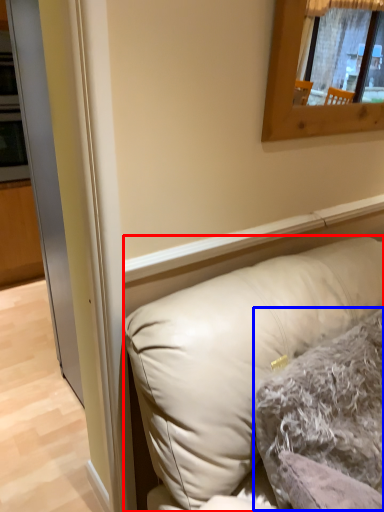
Question: Among these objects, which one is nearest to the camera, pillow (highlighted by a red box) or pillow (highlighted by a blue box)?

Choices:
 (A) pillow
 (B) pillow

Answer: (A)